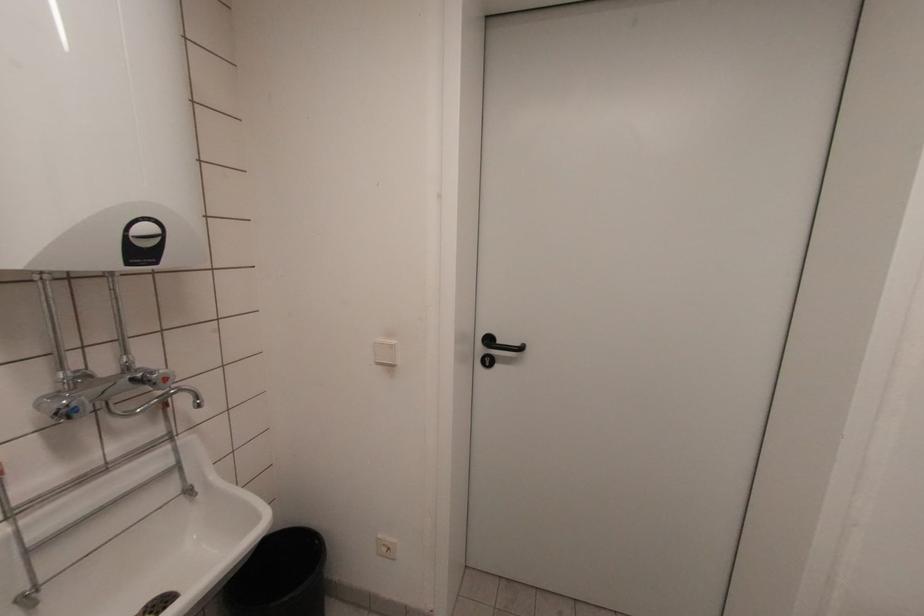
Where would you turn the red faucet handle? Please return your answer as a coordinate pair (x, y).

(163, 379)